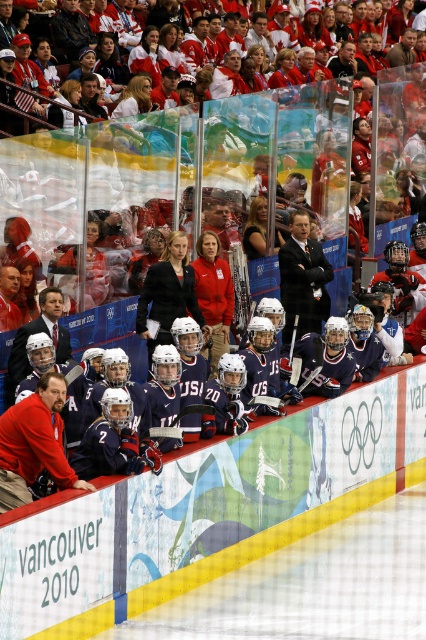
Question: Which object appears farthest from the camera in this image?

Choices:
 (A) matte black hockey at center
 (B) dark blue suit at center
 (C) blue matte hockey stick at center

Answer: (B)

Question: Which is farther from the red fabric jacket at lower left?

Choices:
 (A) matte black hockey stick at center
 (B) matte black hockey at center

Answer: (A)

Question: Is red fabric jacket at lower left further to camera compared to matte black hockey stick at center?

Choices:
 (A) no
 (B) yes

Answer: (A)

Question: Does dark blue suit at center have a greater width compared to matte black hockey at center?

Choices:
 (A) yes
 (B) no

Answer: (B)

Question: Is matte black hockey stick at center positioned in front of blue matte hockey stick at center?

Choices:
 (A) yes
 (B) no

Answer: (A)

Question: Which is nearer to the matte black hockey at center?

Choices:
 (A) red fabric jacket at lower left
 (B) dark blue suit at center
 (C) matte black hockey stick at center

Answer: (C)